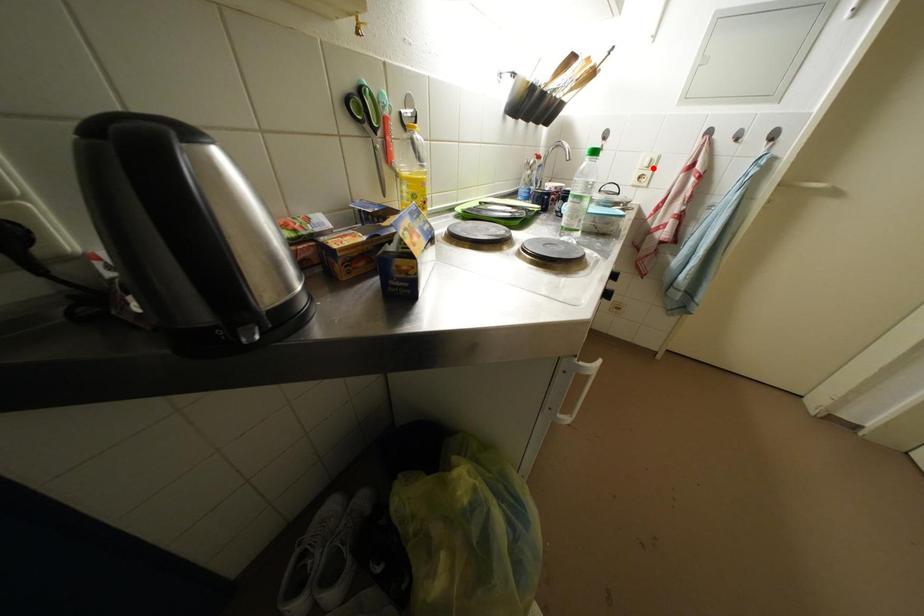
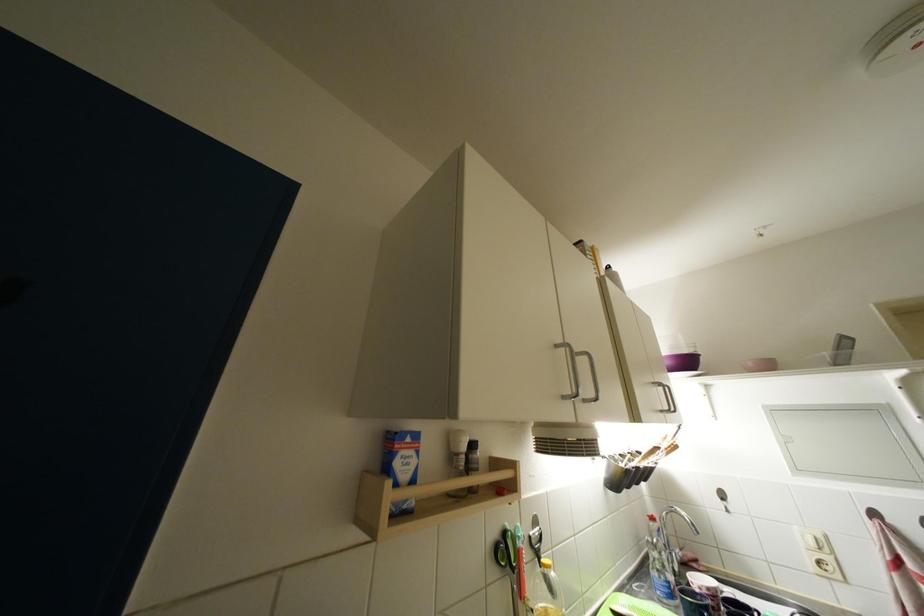
Question: I am providing you with two images of the same scene from different viewpoints. In image1, a red point is highlighted. Considering the same 3D point in image2, which of the following is correct?

Choices:
 (A) It is closer
 (B) It is farther

Answer: (A)